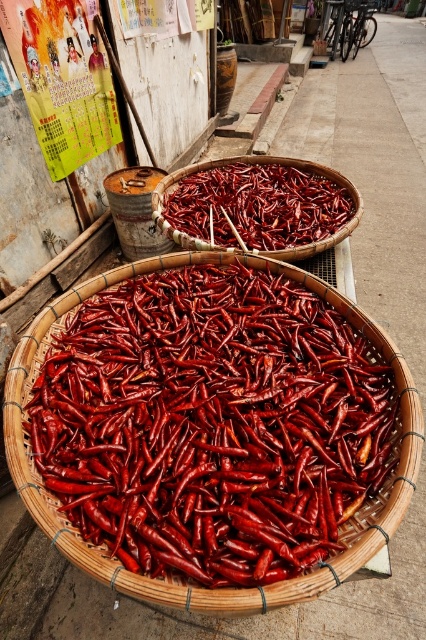
Consider the image. You are an observer standing in front of the baskets. Which object is positioned to the left of the other between the smooth bamboo basket at center and the bright red dried chili peppers at center?

The smooth bamboo basket at center is positioned to the left of the bright red dried chili peppers at center.

You are a vendor preparing to pack the bright red dried chili peppers at center into the smooth bamboo basket at center. Considering the size difference between the two, will the chili peppers fit entirely inside the basket?

The smooth bamboo basket at center is bigger than bright red dried chili peppers at center, so yes, the chili peppers will fit entirely inside the basket.

You are standing in a market and see the smooth bamboo basket at center filled with dried red chili peppers. If you want to reach into the basket to grab some chilies, will your arm need to extend more than 1 meter? Please explain.

The smooth bamboo basket at center is 1.20 meters away from the viewer. Since your arm typically extends about 0.7 meters, you will need to extend your arm more than 1 meter to reach it.